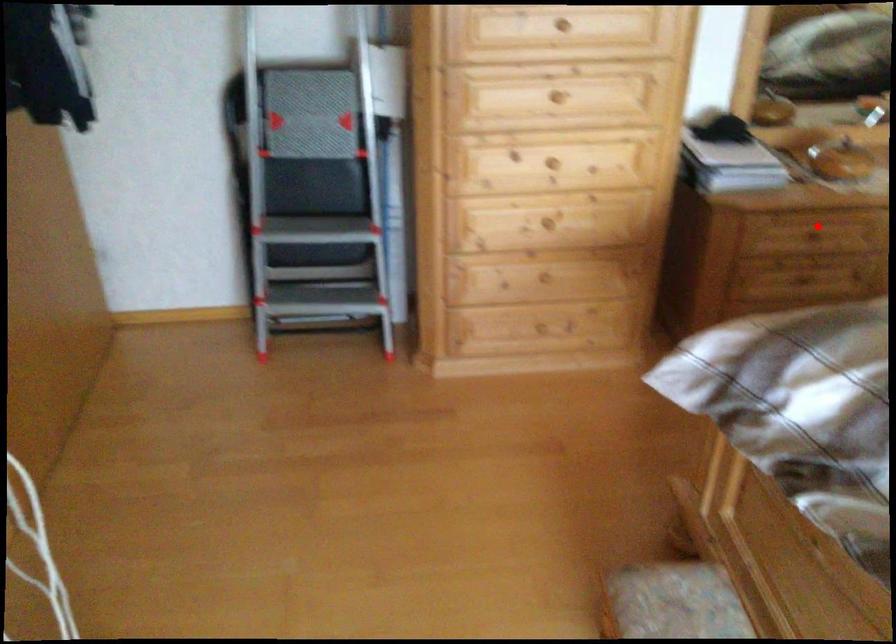
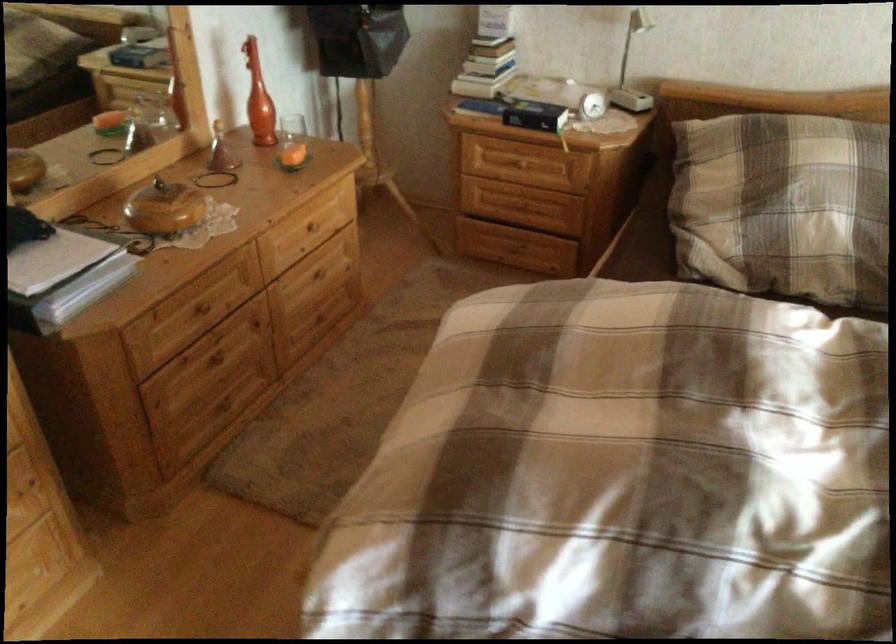
In the second image, find the point that corresponds to the highlighted location in the first image.

(207, 307)